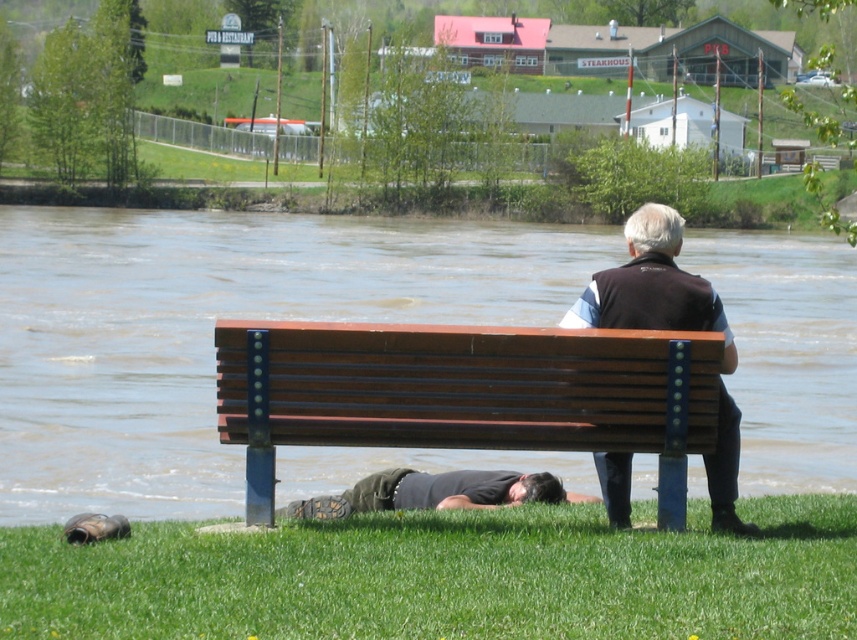
Question: Among these objects, which one is nearest to the camera?

Choices:
 (A) dark gray fabric shirt at lower center
 (B) dark brown leather jacket at center

Answer: (B)

Question: Among these objects, which one is nearest to the camera?

Choices:
 (A) brown water at lower center
 (B) dark brown leather jacket at center
 (C) brown wooden bench at center

Answer: (C)

Question: Does dark brown leather jacket at center appear over dark gray fabric shirt at lower center?

Choices:
 (A) no
 (B) yes

Answer: (B)

Question: Is brown water at lower center below brown wooden bench at center?

Choices:
 (A) no
 (B) yes

Answer: (A)

Question: Which point is closer to the camera?

Choices:
 (A) (363, 467)
 (B) (625, 317)
 (C) (596, 364)
 (D) (526, 500)

Answer: (C)

Question: Does brown water at lower center lie in front of dark gray fabric shirt at lower center?

Choices:
 (A) no
 (B) yes

Answer: (B)